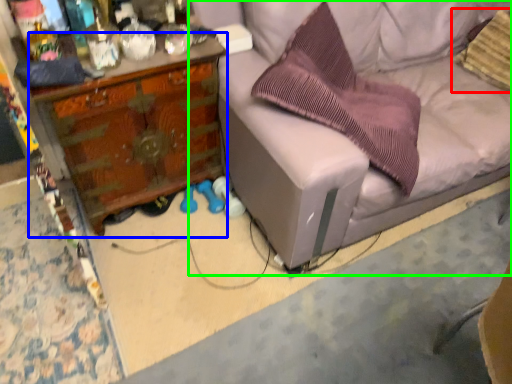
Question: Based on their relative distances, which object is farther from pillow (highlighted by a red box)? Choose from desk (highlighted by a blue box) and studio couch (highlighted by a green box).

Choices:
 (A) desk
 (B) studio couch

Answer: (A)